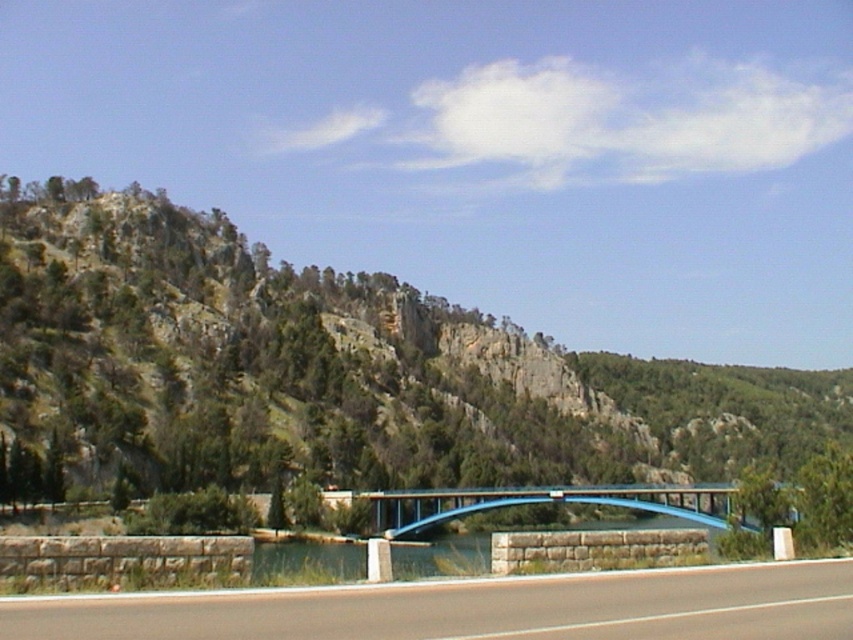
Is green rocky mountain at upper left further to the viewer compared to blue metallic bridge at center?

Yes, green rocky mountain at upper left is behind blue metallic bridge at center.

Does point (590, 387) come closer to viewer compared to point (442, 506)?

No, it is not.

This screenshot has height=640, width=853. What are the coordinates of `green rocky mountain at upper left` in the screenshot? It's located at (337, 369).

Who is positioned more to the right, smooth asphalt highway at center or blue metallic bridge at center?

Positioned to the right is blue metallic bridge at center.

Does smooth asphalt highway at center come behind blue metallic bridge at center?

No.

Image resolution: width=853 pixels, height=640 pixels. I want to click on smooth asphalt highway at center, so click(479, 609).

The height and width of the screenshot is (640, 853). Identify the location of smooth asphalt highway at center. (479, 609).

Which is below, green rocky mountain at upper left or smooth asphalt highway at center?

green rocky mountain at upper left is lower down.

Is green rocky mountain at upper left to the left of smooth asphalt highway at center from the viewer's perspective?

No, green rocky mountain at upper left is not to the left of smooth asphalt highway at center.

The width and height of the screenshot is (853, 640). In order to click on green rocky mountain at upper left in this screenshot , I will do [x=337, y=369].